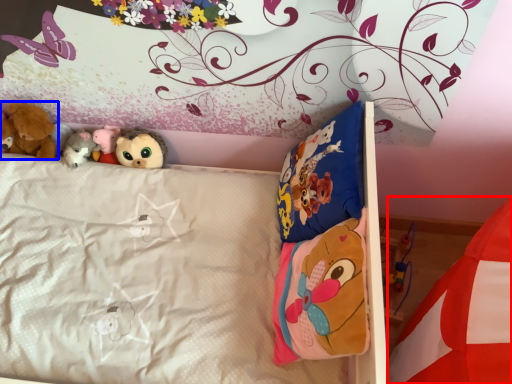
Question: Which object is closer to the camera taking this photo, mattress (highlighted by a red box) or toy (highlighted by a blue box)?

Choices:
 (A) mattress
 (B) toy

Answer: (A)